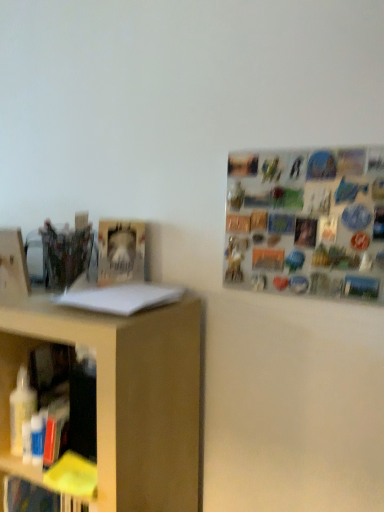
Question: Considering the positions of white paper at left, the 2th book viewed from the top, and hardcover book at center-left, which is the first book from top to bottom, in the image, is white paper at left, the 2th book viewed from the top, bigger or smaller than hardcover book at center-left, which is the first book from top to bottom,?

Choices:
 (A) small
 (B) big

Answer: (A)

Question: Visually, is white paper at left, arranged as the 1th book when viewed from the front, positioned to the left or to the right of hardcover book at center-left, which appears as the second book when ordered from the bottom?

Choices:
 (A) left
 (B) right

Answer: (B)

Question: Which of these objects is positioned farthest from the hardcover book at center-left, arranged as the second book when viewed from the front?

Choices:
 (A) white paper at left, the 2th book viewed from the top
 (B) metallic silver magnets at upper right

Answer: (B)

Question: Which object is positioned closest to the white paper at left, the first book in the bottom-to-top sequence?

Choices:
 (A) hardcover book at center-left, which is the first book from top to bottom
 (B) metallic silver magnets at upper right

Answer: (A)